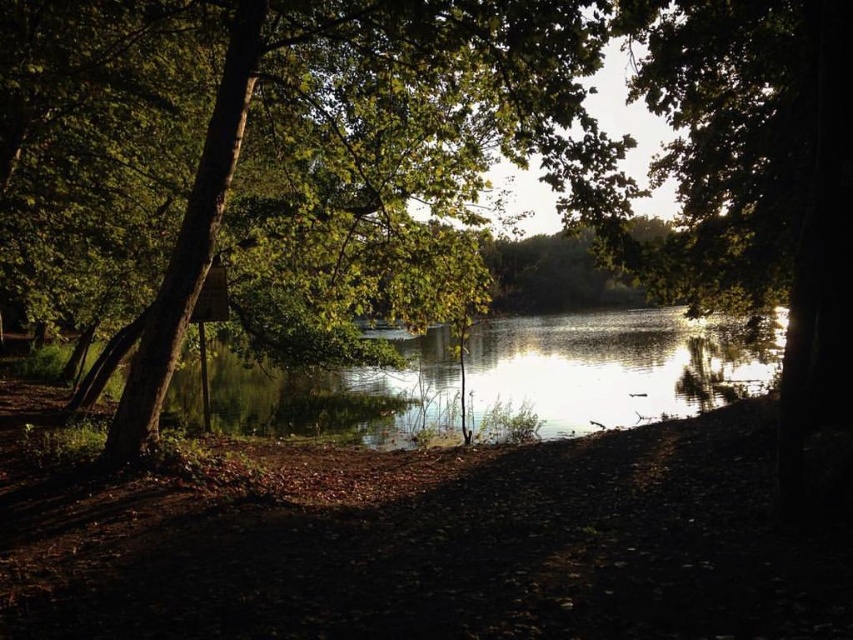
Looking at this image, can you confirm if green leafy tree at center is positioned to the right of glistening water at center?

No, green leafy tree at center is not to the right of glistening water at center.

Is point (494, 67) in front of point (779, 355)?

Yes, it is in front of point (779, 355).

Where is `green leafy tree at center`? green leafy tree at center is located at coordinates (265, 134).